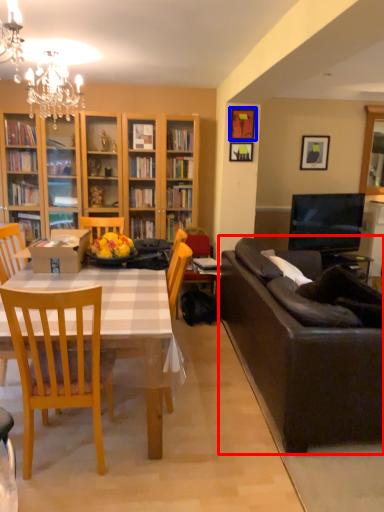
Question: Which object is closer to the camera taking this photo, studio couch (highlighted by a red box) or picture frame (highlighted by a blue box)?

Choices:
 (A) studio couch
 (B) picture frame

Answer: (A)